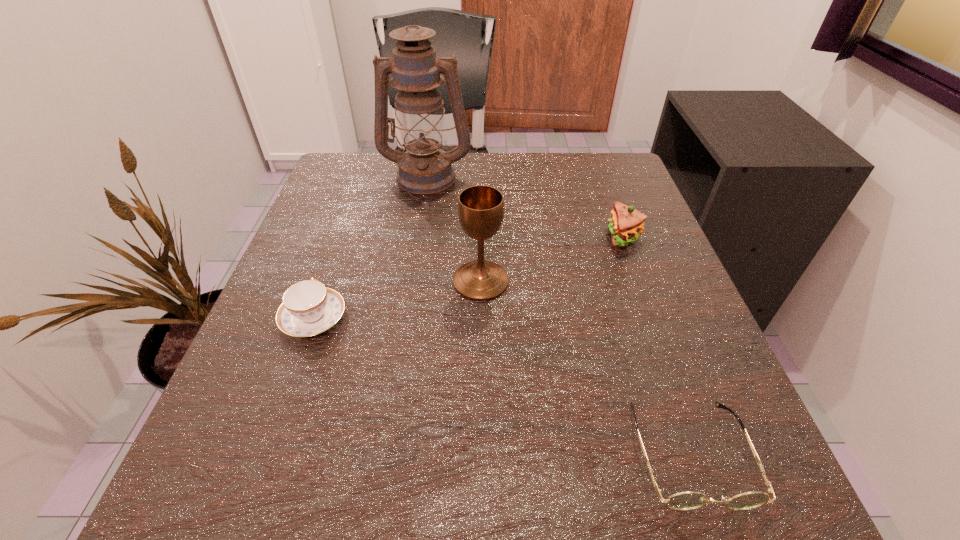
The height and width of the screenshot is (540, 960). In order to click on free space located 0.180m on the front of the second farthest object in this screenshot , I will do `click(656, 327)`.

Where is `free space located 0.100m on the side with the handle of the fourth tallest object`? Image resolution: width=960 pixels, height=540 pixels. free space located 0.100m on the side with the handle of the fourth tallest object is located at coordinates (336, 257).

Locate an element on the screen. free location located 0.150m on the side with the handle of the fourth tallest object is located at coordinates (342, 240).

Image resolution: width=960 pixels, height=540 pixels. Identify the location of vacant region located on the side with the handle of the fourth tallest object. (336, 257).

Where is `object present at the far edge`? object present at the far edge is located at coordinates (425, 169).

At what (x,y) coordinates should I click in order to perform the action: click on object at the near edge. Please return your answer as a coordinate pair (x, y). The width and height of the screenshot is (960, 540). Looking at the image, I should click on (685, 500).

Find the location of `oil lamp that is at the left edge`. oil lamp that is at the left edge is located at coordinates (425, 169).

Locate an element on the screen. The width and height of the screenshot is (960, 540). teacup that is at the left edge is located at coordinates (309, 308).

Image resolution: width=960 pixels, height=540 pixels. I want to click on sandwich that is at the right edge, so click(626, 224).

Locate an element on the screen. The width and height of the screenshot is (960, 540). spectacles positioned at the right edge is located at coordinates (685, 500).